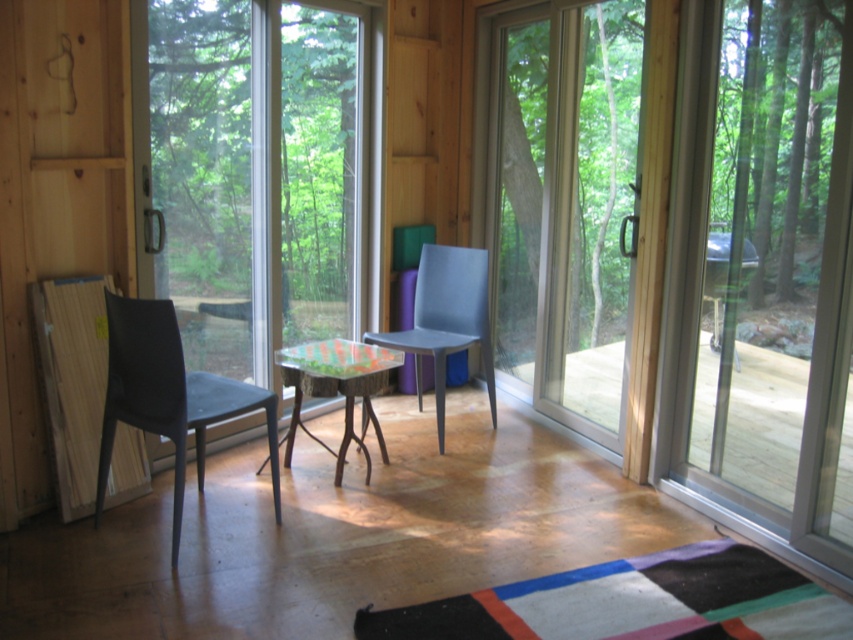
You are standing in the room and want to look outside through the transparent glass window at left. To do this, you need to move away from the matte blue chair at center. Which direction should you move?

The transparent glass window at left is positioned on the left side of the matte blue chair at center. To move away from the matte blue chair at center and towards the window, you should move to the left.

You are standing inside the room and want to exit through the transparent glass screen door at right. Which direction should you move relative to the wooden deck at lower right to reach the door?

To exit through the transparent glass screen door at right, you should move towards the wooden deck at lower right since it is positioned in front of the door, indicating that moving toward it will lead you directly to the door.

You are moving a small potted plant from the indoor area to the deck outside. The potted plant is currently placed on the matte blue chair at center. To exit through the transparent glass screen door at right, will the potted plant fit through the doorway without needing to be repositioned?

The transparent glass screen door at right has a larger size compared to the matte blue chair at center. Since the door is larger, the potted plant on the matte blue chair at center should fit through the doorway without needing to be repositioned.